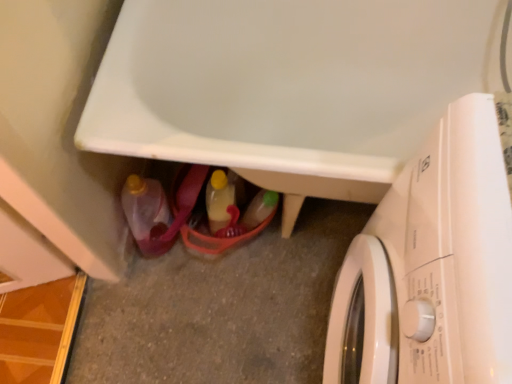
Question: In terms of width, does white glossy bathtub at lower center look wider or thinner when compared to white glossy washing machine at lower right?

Choices:
 (A) wide
 (B) thin

Answer: (A)

Question: Is point (104, 61) closer or farther from the camera than point (488, 119)?

Choices:
 (A) closer
 (B) farther

Answer: (B)

Question: Which is farther from the white glossy washing machine at lower right?

Choices:
 (A) matte plastic bottle at lower left, which is the 1th bottle in left-to-right order
 (B) white glossy bathtub at lower center
 (C) translucent plastic bottle at center, acting as the second bottle starting from the left

Answer: (A)

Question: Which object is positioned closest to the white glossy bathtub at lower center?

Choices:
 (A) translucent plastic bottle at center, acting as the second bottle starting from the left
 (B) matte plastic bottle at lower left, which appears as the second bottle when viewed from the right
 (C) white glossy washing machine at lower right

Answer: (A)